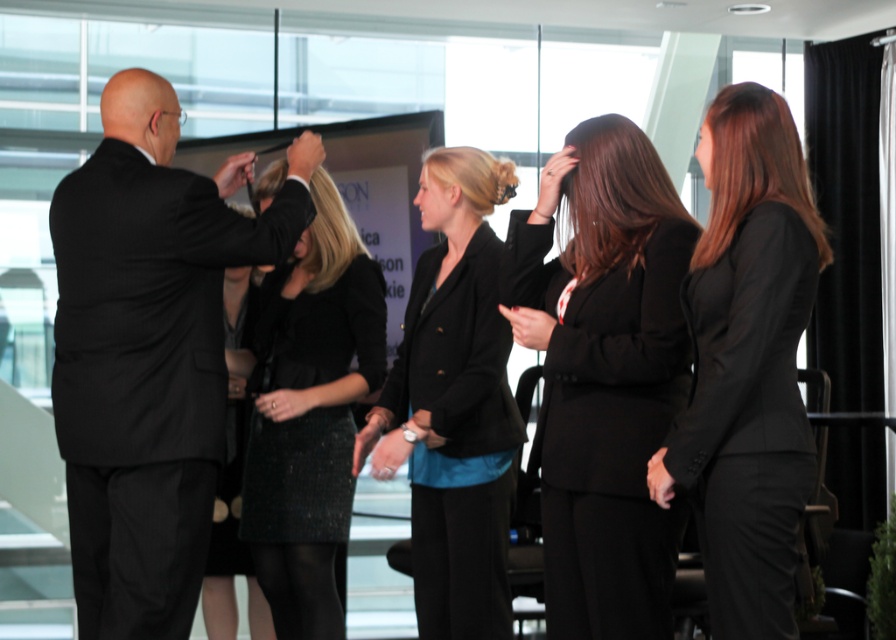
Question: Which of the following is the closest to the observer?

Choices:
 (A) (745, 538)
 (B) (412, 300)
 (C) (226, 260)
 (D) (552, 596)

Answer: (A)

Question: Can you confirm if black textured suit at left is smaller than black smooth suit at right?

Choices:
 (A) no
 (B) yes

Answer: (A)

Question: Which of these objects is positioned farthest from the black smooth suit at right?

Choices:
 (A) black sequined skirt at center
 (B) matte black blazer at center
 (C) black matte suit at center
 (D) black textured suit at left

Answer: (D)

Question: Which object is positioned farthest from the black smooth suit at right?

Choices:
 (A) black matte suit at center
 (B) black textured suit at left
 (C) black sequined skirt at center

Answer: (B)

Question: Can you confirm if black textured suit at left is thinner than black sequined skirt at center?

Choices:
 (A) no
 (B) yes

Answer: (A)

Question: Can you confirm if matte black blazer at center is thinner than black sequined skirt at center?

Choices:
 (A) no
 (B) yes

Answer: (A)